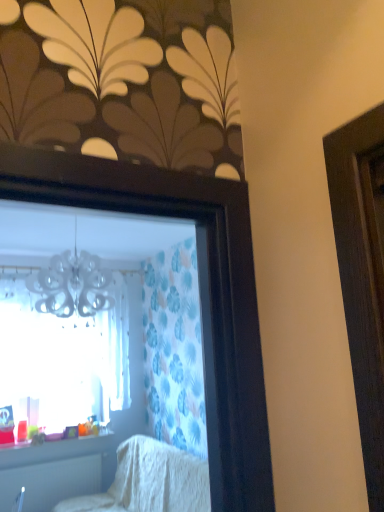
You are a GUI agent. You are given a task and a screenshot of the screen. Output one action in this format:
    pyautogui.click(x=<x>, y=<y>)
    Task: Click on the translucent plastic cups at lower left
    The image size is (384, 512).
    Given the screenshot: What is the action you would take?
    pyautogui.click(x=58, y=449)

What are the coordinates of `transparent glass window at upper left` in the screenshot? It's located at (63, 358).

Identify the location of white plastic radiator at lower left. The width and height of the screenshot is (384, 512). (51, 482).

Are transparent glass window at upper left and white textured blanket at lower center far apart?

No.

Is transparent glass window at upper left completely or partially outside of white textured blanket at lower center?

Yes, transparent glass window at upper left is not within white textured blanket at lower center.

From a real-world perspective, relative to white textured blanket at lower center, is transparent glass window at upper left vertically above or below?

transparent glass window at upper left is situated higher than white textured blanket at lower center in the real world.

Does transparent glass window at upper left come behind white textured blanket at lower center?

That is True.

Is point (48, 451) behind point (58, 331)?

No, (48, 451) is in front of (58, 331).

Which of these two, translucent plastic cups at lower left or transparent glass window at upper left, is smaller?

translucent plastic cups at lower left is smaller.

Does translucent plastic cups at lower left have a greater height compared to transparent glass window at upper left?

No.

Does translucent plastic cups at lower left have a larger size compared to white textured blanket at lower center?

Incorrect, translucent plastic cups at lower left is not larger than white textured blanket at lower center.

Find the location of `furniture below the translucent plastic cups at lower left (from a real-world perspective)`. furniture below the translucent plastic cups at lower left (from a real-world perspective) is located at coordinates (150, 481).

From a real-world perspective, is translucent plastic cups at lower left physically located above or below white textured blanket at lower center?

translucent plastic cups at lower left is above white textured blanket at lower center.

Can you confirm if translucent plastic cups at lower left is positioned to the left of white textured blanket at lower center?

Yes.

Considering the relative sizes of white plastic radiator at lower left and white textured blanket at lower center in the image provided, is white plastic radiator at lower left bigger than white textured blanket at lower center?

No, white plastic radiator at lower left is not bigger than white textured blanket at lower center.

From the image's perspective, is white plastic radiator at lower left beneath white textured blanket at lower center?

Yes.

Is white plastic radiator at lower left placed right next to white textured blanket at lower center?

No.

Is white plastic radiator at lower left oriented towards white textured blanket at lower center?

Yes, white plastic radiator at lower left is facing white textured blanket at lower center.

Consider the image. How much distance is there between transparent glass window at upper left and white plastic radiator at lower left?

transparent glass window at upper left and white plastic radiator at lower left are 30.28 inches apart from each other.

Where is `radiator directly beneath the transparent glass window at upper left (from a real-world perspective)`? The width and height of the screenshot is (384, 512). radiator directly beneath the transparent glass window at upper left (from a real-world perspective) is located at coordinates (51, 482).

Which is more to the right, transparent glass window at upper left or white plastic radiator at lower left?

transparent glass window at upper left is more to the right.

Based on the photo, is transparent glass window at upper left next to white plastic radiator at lower left and touching it?

No, transparent glass window at upper left is not making contact with white plastic radiator at lower left.

Who is taller, white textured blanket at lower center or transparent glass window at upper left?

With more height is transparent glass window at upper left.

Is white textured blanket at lower center turned away from transparent glass window at upper left?

No, white textured blanket at lower center's orientation is not away from transparent glass window at upper left.

Is white textured blanket at lower center next to transparent glass window at upper left and touching it?

No.

From a real-world perspective, which is physically above, white textured blanket at lower center or transparent glass window at upper left?

transparent glass window at upper left.

Looking at this image, between transparent glass window at upper left and translucent plastic cups at lower left, which one has larger width?

translucent plastic cups at lower left.

From the image's perspective, would you say transparent glass window at upper left is shown under translucent plastic cups at lower left?

Actually, transparent glass window at upper left appears above translucent plastic cups at lower left in the image.

Between transparent glass window at upper left and translucent plastic cups at lower left, which one has more height?

Standing taller between the two is transparent glass window at upper left.

From a real-world perspective, is transparent glass window at upper left on top of translucent plastic cups at lower left?

Yes.

I want to click on furniture below the transparent glass window at upper left (from a real-world perspective), so 150,481.

You are a GUI agent. You are given a task and a screenshot of the screen. Output one action in this format:
    pyautogui.click(x=<x>, y=<y>)
    Task: Click on the window above the translucent plastic cups at lower left (from a real-world perspective)
    
    Given the screenshot: What is the action you would take?
    pyautogui.click(x=63, y=358)

Based on the photo, from the image, which object appears to be farther from white plastic radiator at lower left, transparent glass window at upper left or white textured blanket at lower center?

Based on the image, transparent glass window at upper left appears to be further to white plastic radiator at lower left.

Consider the image. Which object lies nearer to the anchor point white textured blanket at lower center, white plastic radiator at lower left or translucent plastic cups at lower left?

Among the two, white plastic radiator at lower left is located nearer to white textured blanket at lower center.

In the scene shown: Based on their spatial positions, is white textured blanket at lower center or transparent glass window at upper left closer to translucent plastic cups at lower left?

Based on the image, transparent glass window at upper left appears to be nearer to translucent plastic cups at lower left.

When comparing their distances from white plastic radiator at lower left, does transparent glass window at upper left or translucent plastic cups at lower left seem closer?

translucent plastic cups at lower left lies closer to white plastic radiator at lower left than the other object.

Based on their spatial positions, is transparent glass window at upper left or white textured blanket at lower center further from translucent plastic cups at lower left?

white textured blanket at lower center is further to translucent plastic cups at lower left.

Considering their positions, is transparent glass window at upper left positioned closer to white textured blanket at lower center than translucent plastic cups at lower left?

translucent plastic cups at lower left.

Based on their spatial positions, is transparent glass window at upper left or white plastic radiator at lower left further from white textured blanket at lower center?

Among the two, transparent glass window at upper left is located further to white textured blanket at lower center.

Which object lies nearer to the anchor point white textured blanket at lower center, translucent plastic cups at lower left or white plastic radiator at lower left?

Among the two, white plastic radiator at lower left is located nearer to white textured blanket at lower center.

This screenshot has width=384, height=512. Identify the location of window between white textured blanket at lower center and white plastic radiator at lower left along the z-axis. (x=63, y=358).

Where is `window sill between transparent glass window at upper left and white plastic radiator at lower left in the vertical direction`? This screenshot has width=384, height=512. window sill between transparent glass window at upper left and white plastic radiator at lower left in the vertical direction is located at coordinates (58, 449).

The image size is (384, 512). Find the location of `window between white textured blanket at lower center and translucent plastic cups at lower left in the front-back direction`. window between white textured blanket at lower center and translucent plastic cups at lower left in the front-back direction is located at coordinates (63, 358).

Where is `radiator located between white textured blanket at lower center and translucent plastic cups at lower left in the depth direction`? Image resolution: width=384 pixels, height=512 pixels. radiator located between white textured blanket at lower center and translucent plastic cups at lower left in the depth direction is located at coordinates (51, 482).